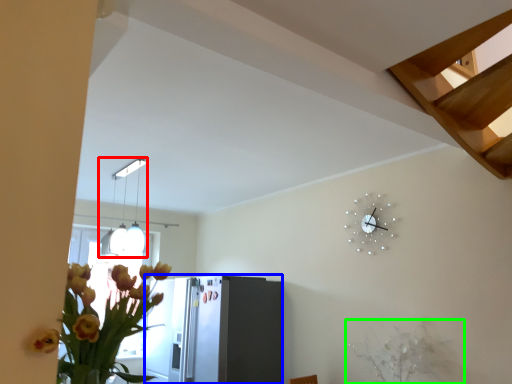
Question: Based on their relative distances, which object is nearer to lamp (highlighted by a red box)? Choose from appliance (highlighted by a blue box) and plant (highlighted by a green box).

Choices:
 (A) appliance
 (B) plant

Answer: (A)